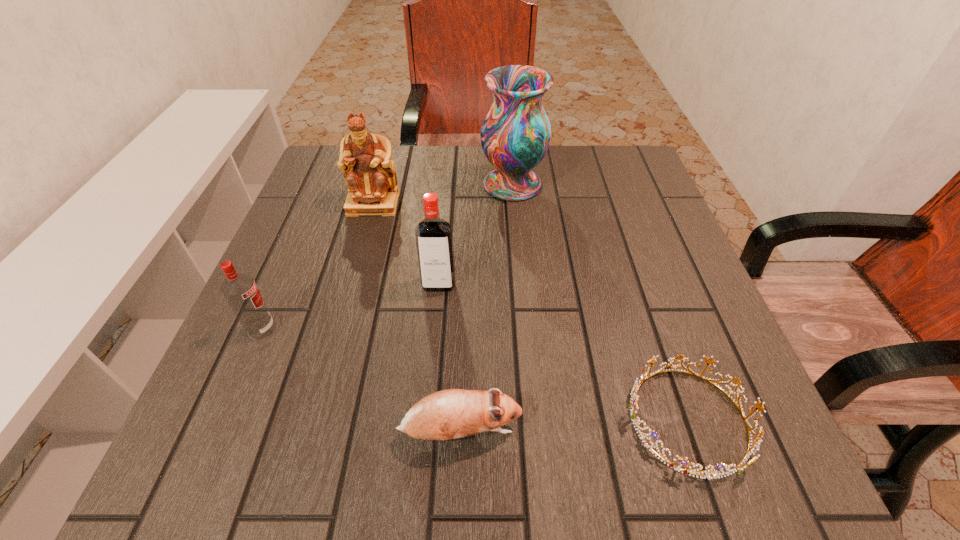
Locate an element on the screen. The image size is (960, 540). tiara that is at the near edge is located at coordinates (633, 404).

You are a GUI agent. You are given a task and a screenshot of the screen. Output one action in this format:
    pyautogui.click(x=<x>, y=<y>)
    Task: Click on the figurine located at the left edge
    The image size is (960, 540).
    Given the screenshot: What is the action you would take?
    pyautogui.click(x=365, y=158)

In order to click on vodka present at the left edge in this screenshot , I will do `click(240, 290)`.

I want to click on object located at the right edge, so click(633, 404).

Locate an element on the screen. The width and height of the screenshot is (960, 540). object situated at the far left corner is located at coordinates (365, 158).

Locate an element on the screen. The image size is (960, 540). object located in the near right corner section of the desktop is located at coordinates (633, 404).

In the image, there is a desktop. Identify the location of vacant space at the far edge. The height and width of the screenshot is (540, 960). (415, 162).

This screenshot has height=540, width=960. Identify the location of free region at the near edge of the desktop. (317, 482).

In the image, there is a desktop. Identify the location of vacant space at the left edge. This screenshot has height=540, width=960. (302, 347).

In the image, there is a desktop. What are the coordinates of `free space at the right edge` in the screenshot? It's located at (637, 200).